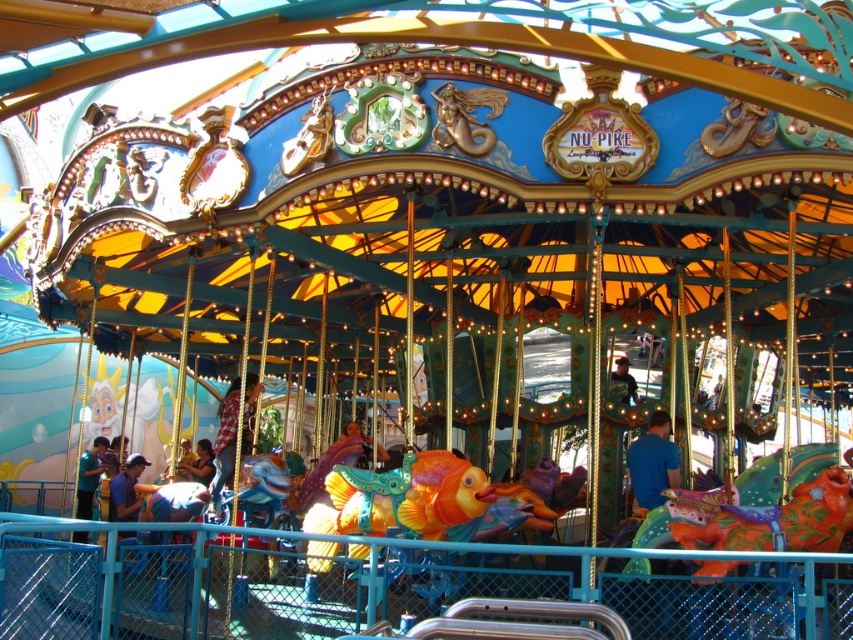
Is blue matte shirt at center below matte blue shirt at lower center?

Actually, blue matte shirt at center is above matte blue shirt at lower center.

Is blue matte shirt at center positioned before matte blue shirt at lower center?

Yes, blue matte shirt at center is closer to the viewer.

What are the coordinates of `blue matte shirt at center` in the screenshot? It's located at [x=653, y=461].

Between plaid shirt at center and blue fabric shirt at lower left, which one is positioned higher?

plaid shirt at center

Does plaid shirt at center come in front of blue fabric shirt at lower left?

No, it is behind blue fabric shirt at lower left.

Which is in front, point (213, 444) or point (78, 508)?

Point (78, 508) is more forward.

This screenshot has width=853, height=640. Identify the location of plaid shirt at center. (225, 440).

Does blue matte shirt at center have a larger size compared to plaid shirt at center?

Actually, blue matte shirt at center might be smaller than plaid shirt at center.

Identify the location of blue matte shirt at center. (653, 461).